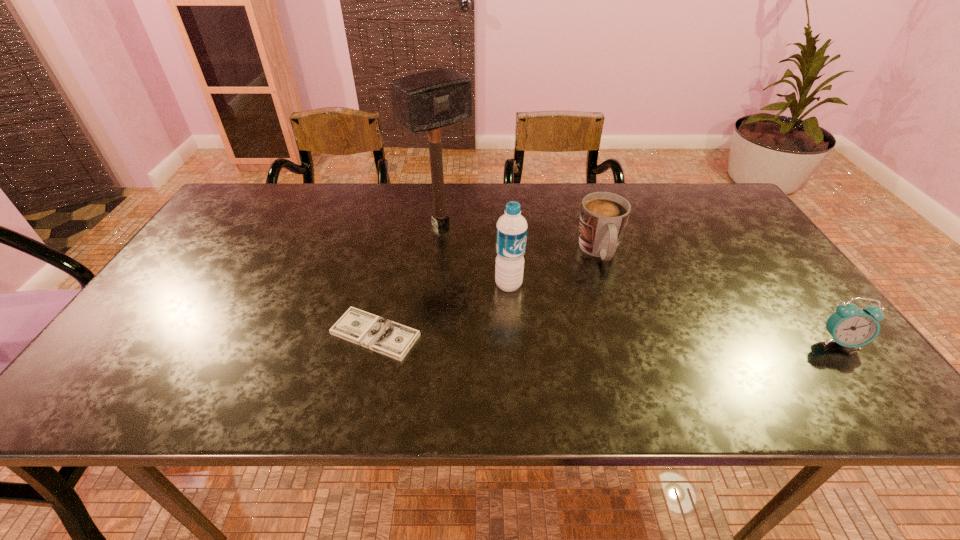
Locate an element on the screen. empty location between the mug and the alarm clock is located at coordinates (719, 296).

Where is `empty space between the third object from left to right and the mallet`? empty space between the third object from left to right and the mallet is located at coordinates (474, 254).

Where is `free space between the second object from right to left and the shortest object`? Image resolution: width=960 pixels, height=540 pixels. free space between the second object from right to left and the shortest object is located at coordinates (488, 293).

At what (x,y) coordinates should I click in order to perform the action: click on vacant area that lies between the mug and the second tallest object. Please return your answer as a coordinate pair (x, y). The image size is (960, 540). Looking at the image, I should click on (554, 268).

You are a GUI agent. You are given a task and a screenshot of the screen. Output one action in this format:
    pyautogui.click(x=<x>, y=<y>)
    Task: Click on the unoccupied position between the mallet and the third nearest object
    This screenshot has height=540, width=960.
    Given the screenshot: What is the action you would take?
    pyautogui.click(x=474, y=254)

I want to click on object identified as the third closest to the shortest object, so pos(603,217).

The width and height of the screenshot is (960, 540). Identify the location of object that is the second closest to the shortest object. (427, 101).

At what (x,y) coordinates should I click in order to perform the action: click on free space that satisfies the following two spatial constraints: 1. on the back side of the tallest object; 2. on the left side of the dollar. Please return your answer as a coordinate pair (x, y). Image resolution: width=960 pixels, height=540 pixels. Looking at the image, I should click on (401, 223).